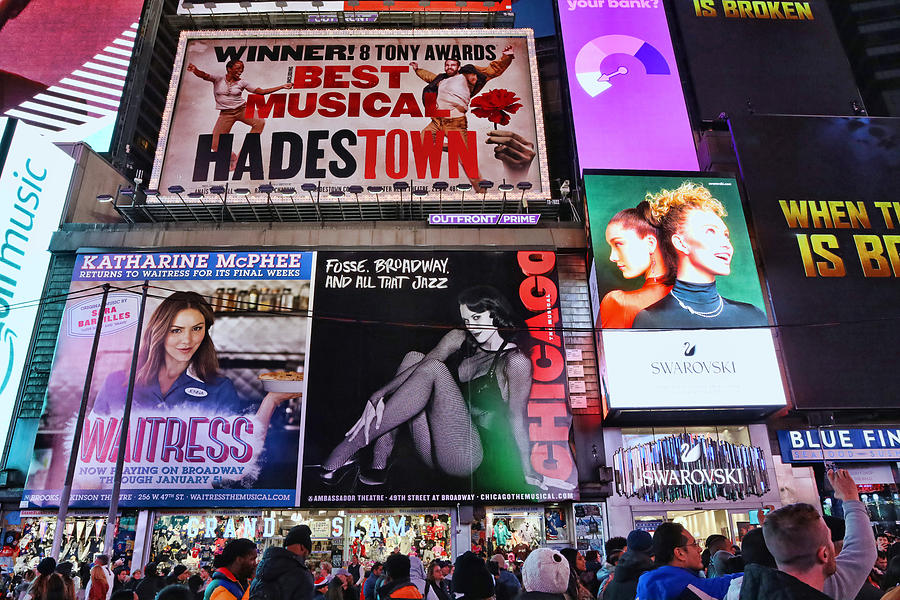
Find the location of a particular element. Image resolution: width=900 pixels, height=600 pixels. light purple lighted sign is located at coordinates (645, 105).